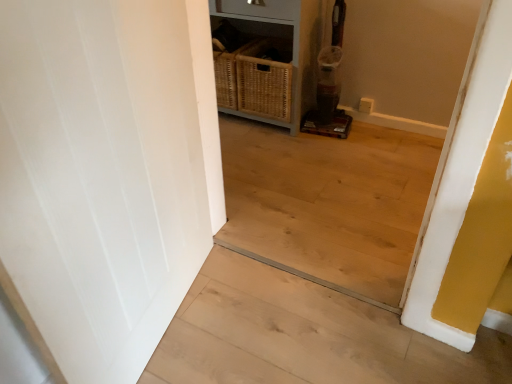
Question: Is woven wood dresser at center not near white wood stairwell at left?

Choices:
 (A) no
 (B) yes

Answer: (B)

Question: From a real-world perspective, is woven wood dresser at center positioned over white wood stairwell at left based on gravity?

Choices:
 (A) yes
 (B) no

Answer: (A)

Question: From the image's perspective, would you say woven wood dresser at center is shown under white wood stairwell at left?

Choices:
 (A) yes
 (B) no

Answer: (B)

Question: Is the position of woven wood dresser at center more distant than that of white wood stairwell at left?

Choices:
 (A) no
 (B) yes

Answer: (B)

Question: Considering the relative sizes of woven wood dresser at center and white wood stairwell at left in the image provided, is woven wood dresser at center taller than white wood stairwell at left?

Choices:
 (A) yes
 (B) no

Answer: (A)

Question: Does woven wood dresser at center contain white wood stairwell at left?

Choices:
 (A) no
 (B) yes

Answer: (A)

Question: Is white wood stairwell at left oriented towards woven wood dresser at center?

Choices:
 (A) yes
 (B) no

Answer: (B)

Question: Is white wood stairwell at left far from woven wood dresser at center?

Choices:
 (A) yes
 (B) no

Answer: (A)

Question: Is white wood stairwell at left to the left of woven wood dresser at center from the viewer's perspective?

Choices:
 (A) no
 (B) yes

Answer: (A)

Question: Does white wood stairwell at left have a greater height compared to woven wood dresser at center?

Choices:
 (A) no
 (B) yes

Answer: (A)

Question: From a real-world perspective, does white wood stairwell at left stand above woven wood dresser at center?

Choices:
 (A) yes
 (B) no

Answer: (B)

Question: From the image's perspective, is white wood stairwell at left located above woven wood dresser at center?

Choices:
 (A) no
 (B) yes

Answer: (A)

Question: From a real-world perspective, is white wood stairwell at left positioned above or below woven wood dresser at center?

Choices:
 (A) below
 (B) above

Answer: (A)